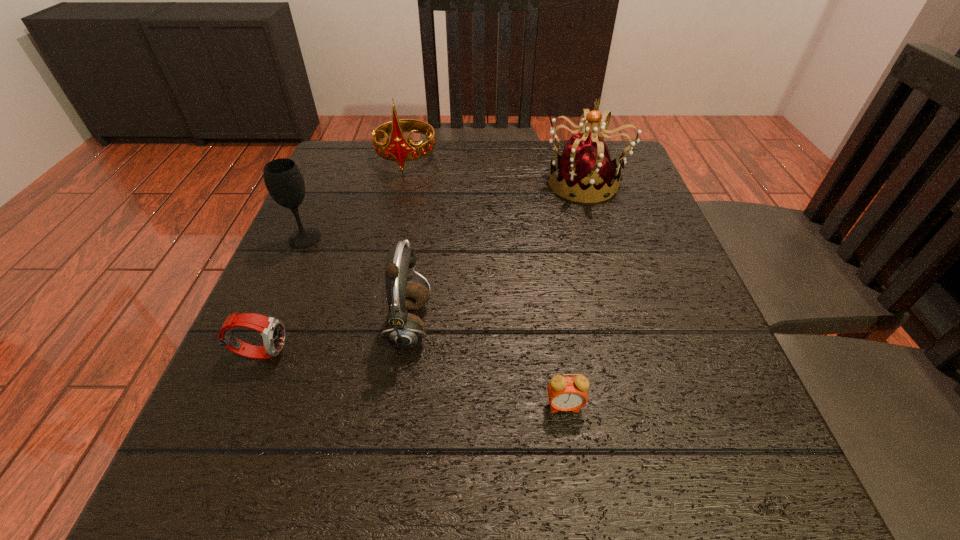
This screenshot has width=960, height=540. Find the location of `vacant space that's between the earphone and the wineglass`. vacant space that's between the earphone and the wineglass is located at coordinates click(x=357, y=282).

Where is `empty location between the watch and the rightmost object`? empty location between the watch and the rightmost object is located at coordinates [423, 267].

Where is `free point between the watch and the left tiara`? This screenshot has width=960, height=540. free point between the watch and the left tiara is located at coordinates (333, 255).

Locate an element on the screen. Image resolution: width=960 pixels, height=540 pixels. empty space between the alarm clock and the earphone is located at coordinates (487, 366).

Locate an element on the screen. The height and width of the screenshot is (540, 960). vacant space that is in between the watch and the earphone is located at coordinates (335, 339).

At what (x,y) coordinates should I click in order to perform the action: click on free space between the left tiara and the wineglass. Please return your answer as a coordinate pair (x, y). Looking at the image, I should click on (x=355, y=198).

Find the location of a particular element. Image resolution: width=960 pixels, height=540 pixels. free area in between the nearest object and the earphone is located at coordinates (487, 366).

This screenshot has width=960, height=540. In order to click on the second closest object to the right tiara in this screenshot , I will do `click(403, 330)`.

This screenshot has height=540, width=960. Identify the location of the second closest object relative to the right tiara. (403, 330).